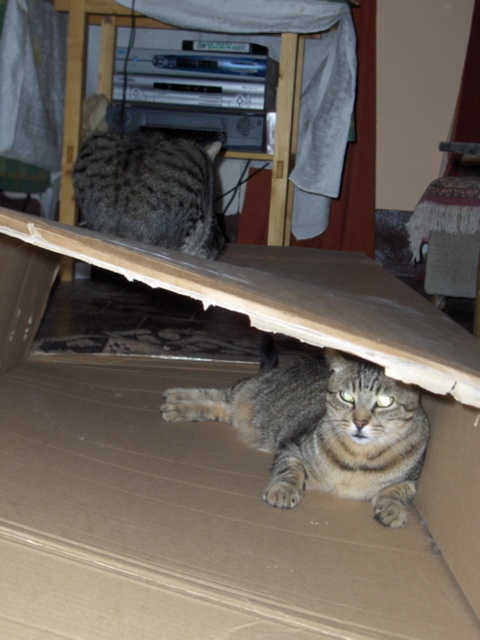
You are a photographer trying to capture a photo of both cats in the box. You notice two points marked in the image. Which point is closer to you, point (x=24, y=320) or point (x=393, y=449)?

Point (x=24, y=320) is closer to you than point (x=393, y=449).

You are a cat owner who wants to place a small toy inside the brown cardboard box at lower center. Given that the box is represented by the point coordinates point (227, 460), can you determine if the toy will fit inside the box?

The brown cardboard box at lower center is represented by point (227, 460). Since the coordinates indicate the box location, the toy can be placed inside the box as long as its dimensions are smaller than the box.

You are a cat owner who wants to ensure the tabby fur cat at lower center can exit the brown cardboard box at lower center. Based on the scene, is the cat currently inside the box?

The brown cardboard box at lower center is in front of the tabby fur cat at lower center, so the cat is not entirely inside the box and can exit easily.